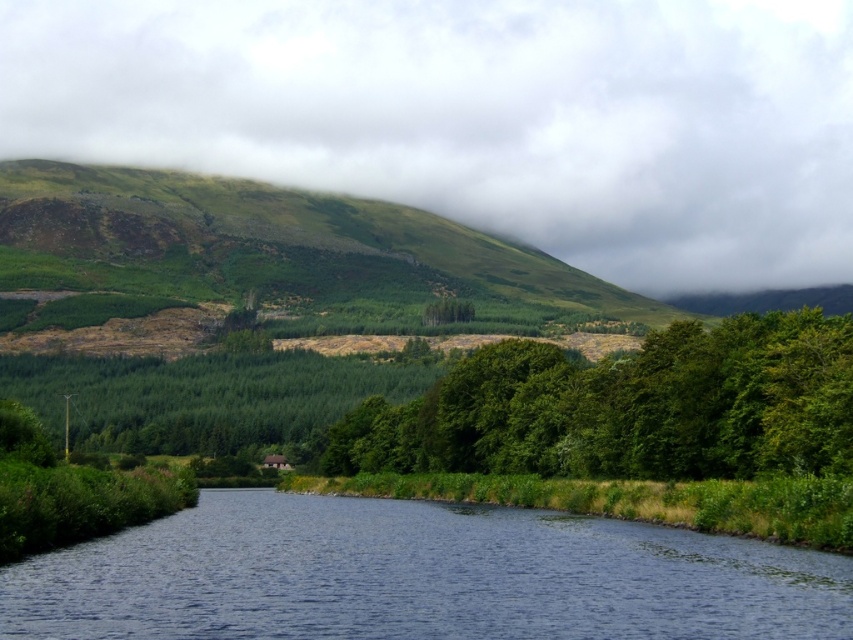
You are standing at the edge of the blue water at center and want to climb up to the green grassy hillside at upper left. Based on the scene description, which direction should you face to ascend the slope?

Since the blue water at center is lower in height than the green grassy hillside at upper left, you should face towards the upper left direction to ascend the slope towards the hillside.

You are a bird flying over the landscape and want to land on the highest point between the blue water at center and the green leafy trees at center. Which should you choose?

The green leafy trees at center are taller than the blue water at center, so you should choose the green leafy trees at center to land on the highest point.

You are standing at the center of the image and want to reach the green matte hillside at upper center. Which direction should you move in to get there?

To reach the green matte hillside at upper center, you should move upward since it is located at the upper part of the image.